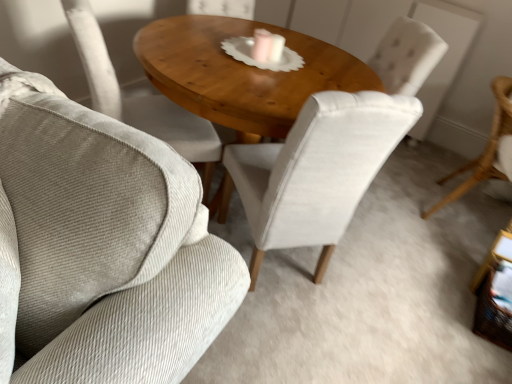
Question: From the image's perspective, would you say velvet white chair at center, placed as the 2th chair when sorted from left to right, is shown under light beige fabric chair at center, which ranks as the third chair in right-to-left order?

Choices:
 (A) no
 (B) yes

Answer: (B)

Question: Can you confirm if velvet white chair at center, placed as the 2th chair when sorted from left to right, is positioned to the left of light beige fabric chair at center, which ranks as the third chair in right-to-left order?

Choices:
 (A) yes
 (B) no

Answer: (B)

Question: Is velvet white chair at center, which ranks as the 2th chair in right-to-left order, wider than light beige fabric chair at center, which is counted as the first chair, starting from the left?

Choices:
 (A) no
 (B) yes

Answer: (B)

Question: From the image's perspective, is velvet white chair at center, which ranks as the 2th chair in right-to-left order, on light beige fabric chair at center, which ranks as the third chair in right-to-left order?

Choices:
 (A) no
 (B) yes

Answer: (A)

Question: Can you confirm if velvet white chair at center, which ranks as the 2th chair in right-to-left order, is taller than light beige fabric chair at center, which ranks as the third chair in right-to-left order?

Choices:
 (A) yes
 (B) no

Answer: (A)

Question: Is velvet white chair at center, placed as the 2th chair when sorted from left to right, at the right side of light beige fabric chair at center, which is counted as the first chair, starting from the left?

Choices:
 (A) no
 (B) yes

Answer: (B)

Question: Does velvet white chair at center, placed as the 2th chair when sorted from left to right, have a lesser height compared to wooden polished table at center?

Choices:
 (A) yes
 (B) no

Answer: (B)

Question: Considering the relative sizes of velvet white chair at center, placed as the 2th chair when sorted from left to right, and wooden polished table at center in the image provided, is velvet white chair at center, placed as the 2th chair when sorted from left to right, wider than wooden polished table at center?

Choices:
 (A) yes
 (B) no

Answer: (B)

Question: Does velvet white chair at center, placed as the 2th chair when sorted from left to right, come in front of wooden polished table at center?

Choices:
 (A) no
 (B) yes

Answer: (B)

Question: Does velvet white chair at center, placed as the 2th chair when sorted from left to right, appear on the right side of wooden polished table at center?

Choices:
 (A) no
 (B) yes

Answer: (B)

Question: Does velvet white chair at center, placed as the 2th chair when sorted from left to right, have a smaller size compared to wooden polished table at center?

Choices:
 (A) no
 (B) yes

Answer: (B)

Question: From the image's perspective, does velvet white chair at center, placed as the 2th chair when sorted from left to right, appear lower than wooden polished table at center?

Choices:
 (A) no
 (B) yes

Answer: (B)

Question: Is woven wicker side table at lower right not inside light beige fabric chair at center, which is counted as the first chair, starting from the left?

Choices:
 (A) yes
 (B) no

Answer: (A)